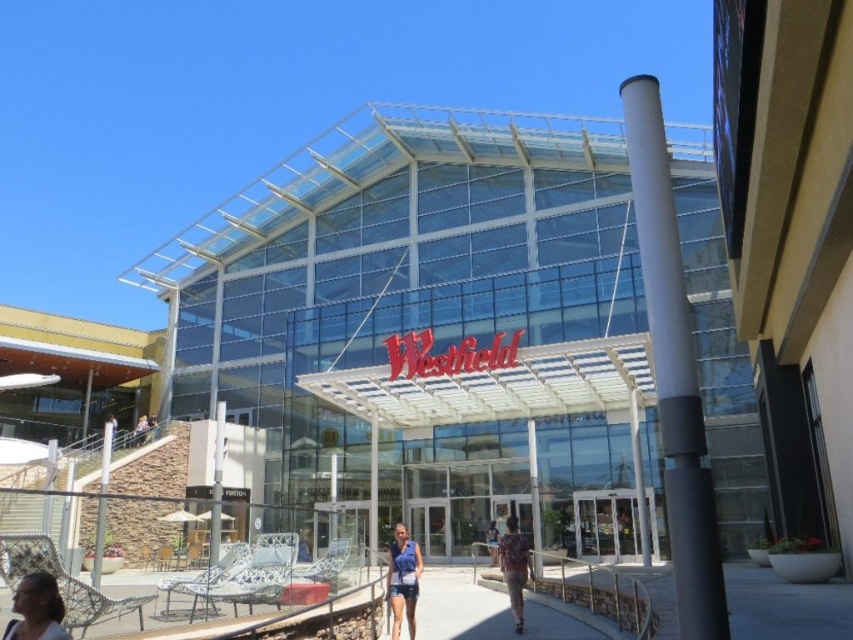
Is point (531, 596) less distant than point (390, 595)?

No, it is behind (390, 595).

Locate an element on the screen. The height and width of the screenshot is (640, 853). matte blue shorts at center is located at coordinates (462, 605).

Find the location of a particular element. This screenshot has width=853, height=640. matte blue shorts at center is located at coordinates (462, 605).

Which is above, matte black hair at lower left or blue denim shorts at center?

matte black hair at lower left

Can you confirm if matte black hair at lower left is positioned to the right of blue denim shorts at center?

Incorrect, matte black hair at lower left is not on the right side of blue denim shorts at center.

Who is more forward, (x=53, y=616) or (x=410, y=570)?

Positioned in front is point (x=53, y=616).

Identify the location of matte black hair at lower left. (38, 609).

Locate an element on the screen. matte black hair at lower left is located at coordinates (38, 609).

Between matte black hair at lower left and floral fabric shirt at lower center, which one has more height?

floral fabric shirt at lower center

The width and height of the screenshot is (853, 640). What do you see at coordinates (38, 609) in the screenshot? I see `matte black hair at lower left` at bounding box center [38, 609].

At what (x,y) coordinates should I click in order to perform the action: click on matte black hair at lower left. Please return your answer as a coordinate pair (x, y). Looking at the image, I should click on (38, 609).